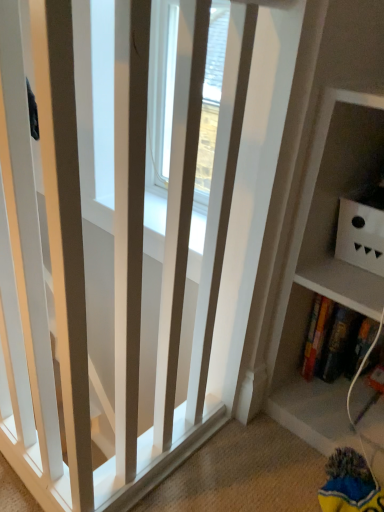
Question: In terms of height, does hardcover book at lower right look taller or shorter compared to white matte box at upper right?

Choices:
 (A) tall
 (B) short

Answer: (A)

Question: Does point (365, 351) appear closer or farther from the camera than point (370, 227)?

Choices:
 (A) farther
 (B) closer

Answer: (A)

Question: In the image, is hardcover book at lower right positioned in front of or behind white matte box at upper right?

Choices:
 (A) front
 (B) behind

Answer: (B)

Question: Is white matte box at upper right taller or shorter than hardcover book at lower right?

Choices:
 (A) short
 (B) tall

Answer: (A)

Question: From a real-world perspective, is white matte box at upper right positioned above or below hardcover book at lower right?

Choices:
 (A) above
 (B) below

Answer: (A)

Question: Choose the correct answer: Is white matte box at upper right inside hardcover book at lower right or outside it?

Choices:
 (A) inside
 (B) outside

Answer: (B)

Question: Relative to hardcover book at lower right, is white matte box at upper right in front or behind?

Choices:
 (A) behind
 (B) front

Answer: (B)